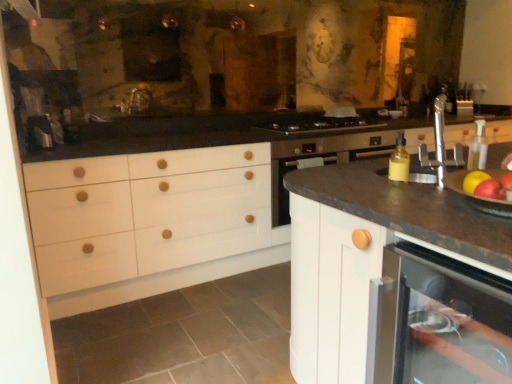
Question: From a real-world perspective, is yellow matte bottle at right above or below stainless steel gas stove at center?

Choices:
 (A) below
 (B) above

Answer: (B)

Question: Considering the positions of yellow matte bottle at right and stainless steel gas stove at center in the image, is yellow matte bottle at right taller or shorter than stainless steel gas stove at center?

Choices:
 (A) short
 (B) tall

Answer: (B)

Question: Which is nearer to the shiny red apple at right, arranged as the 1th apple when viewed from the back?

Choices:
 (A) stainless steel gas stove at center
 (B) white matte cabinet at center
 (C) red matte apple at right, the second apple from the back
 (D) yellow matte bottle at right
 (E) matte white dishwasher at lower right

Answer: (C)

Question: Considering the real-world distances, which object is closest to the stainless steel gas stove at center?

Choices:
 (A) yellow matte bottle at right
 (B) white matte cabinet at center
 (C) red matte apple at right, the second apple from the back
 (D) shiny red apple at right, arranged as the 1th apple when viewed from the back
 (E) matte white dishwasher at lower right

Answer: (A)